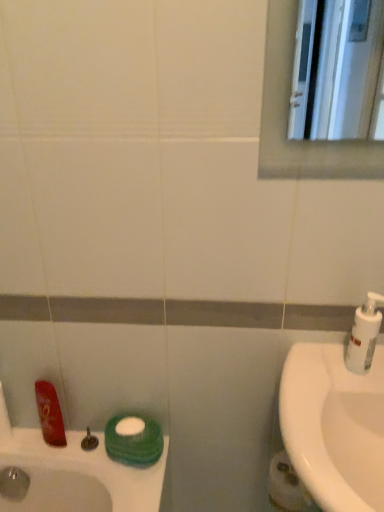
You are a GUI agent. You are given a task and a screenshot of the screen. Output one action in this format:
    pyautogui.click(x=<x>, y=<y>)
    Task: Click on the free space that is to the left of white plastic soap dispenser at right
    This screenshot has width=384, height=512.
    Given the screenshot: What is the action you would take?
    pyautogui.click(x=311, y=374)